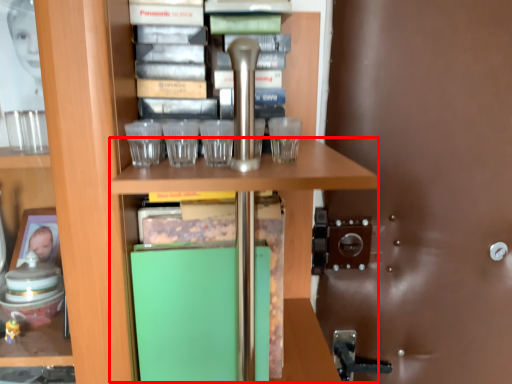
Question: From the image's perspective, where is table (annotated by the red box) located in relation to glass door in the image?

Choices:
 (A) below
 (B) above

Answer: (A)